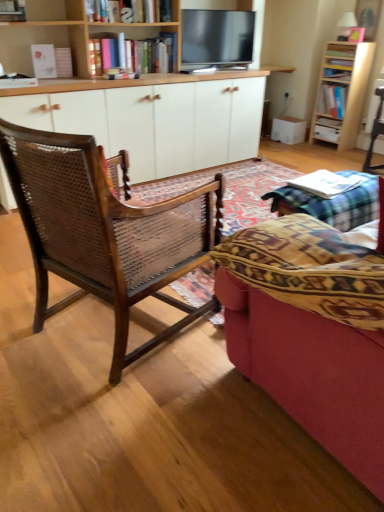
Question: Choose the correct answer: Is flat screen tv at upper center inside white wood cabinet at center or outside it?

Choices:
 (A) outside
 (B) inside

Answer: (A)

Question: Considering the positions of flat screen tv at upper center and white wood cabinet at center in the image, is flat screen tv at upper center wider or thinner than white wood cabinet at center?

Choices:
 (A) thin
 (B) wide

Answer: (A)

Question: Which is nearer to the wooden bookcase at upper right, acting as the 2th bookcase starting from the left?

Choices:
 (A) white glossy drawer at center
 (B) white wood cabinet at center
 (C) wooden bookshelf at upper center, which appears as the second bookcase when viewed from the right
 (D) white paper book at center, which is counted as the 1th book, starting from the left
 (E) wooden cane chair at left

Answer: (A)

Question: Which is nearer to the wooden bookshelf at upper center, which is the first bookcase from front to back?

Choices:
 (A) white paper book at center, the 3th book when ordered from right to left
 (B) hardcover book at upper right, arranged as the first book when viewed from the top
 (C) white glossy drawer at center
 (D) flat screen tv at upper center
 (E) hardcover book at upper right, which ranks as the third book in front-to-back order

Answer: (D)